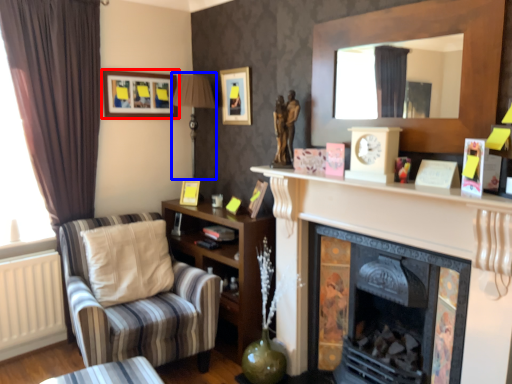
Question: Which object is closer to the camera taking this photo, picture frame (highlighted by a red box) or lamp (highlighted by a blue box)?

Choices:
 (A) picture frame
 (B) lamp

Answer: (B)